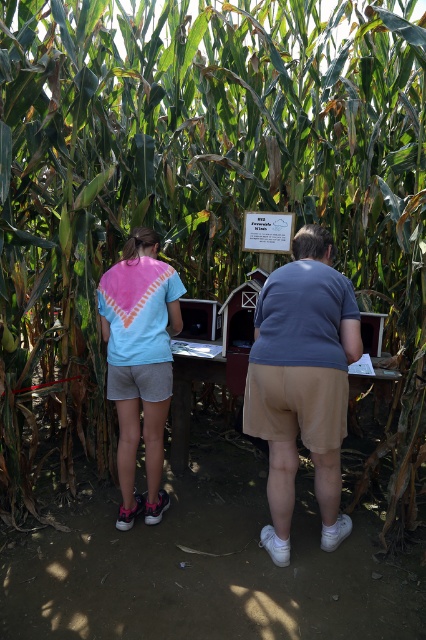
Which is more to the left, matte blue shirt at center or pink tie-dye t-shirt at center?

From the viewer's perspective, pink tie-dye t-shirt at center appears more on the left side.

Which is behind, point (317, 342) or point (117, 346)?

Point (117, 346)

Locate an element on the screen. This screenshot has width=426, height=640. matte blue shirt at center is located at coordinates (302, 381).